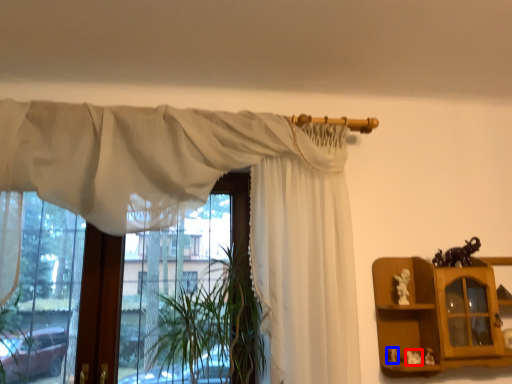
Question: Which object appears farthest to the camera in this image, toy (highlighted by a red box) or toy (highlighted by a blue box)?

Choices:
 (A) toy
 (B) toy

Answer: (B)